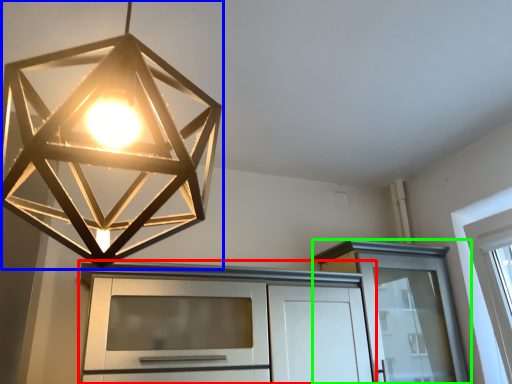
Question: Which object is the farthest from cabinetry (highlighted by a red box)? Choose among these: lamp (highlighted by a blue box) or cabinetry (highlighted by a green box).

Choices:
 (A) lamp
 (B) cabinetry

Answer: (A)